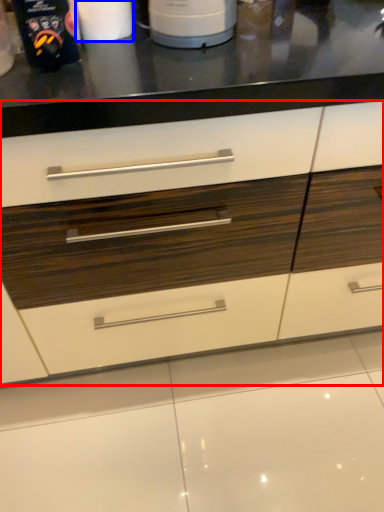
Question: Which of the following is the closest to the observer, drawer (highlighted by a red box) or paper towel (highlighted by a blue box)?

Choices:
 (A) drawer
 (B) paper towel

Answer: (A)